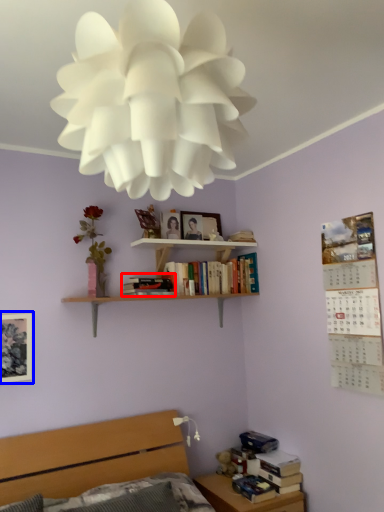
Question: Which point is closer to the camera, book (highlighted by a red box) or picture frame (highlighted by a blue box)?

Choices:
 (A) book
 (B) picture frame

Answer: (B)